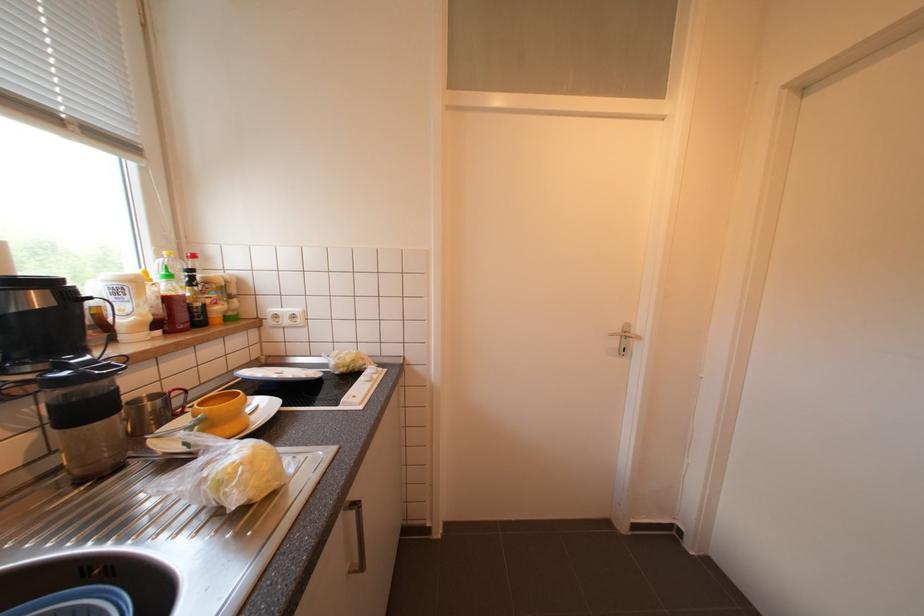
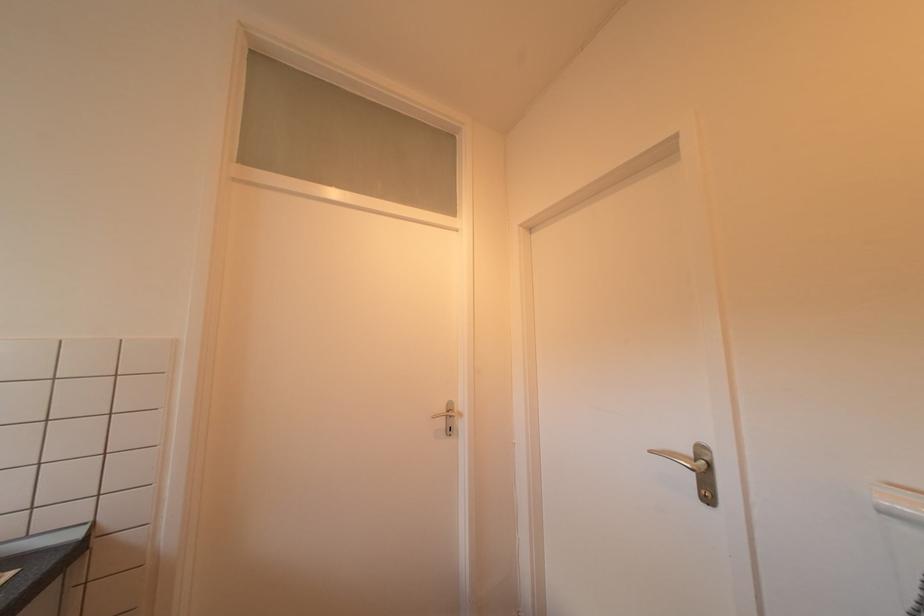
Question: Based on the continuous images, in which direction is the camera rotating? Reply with the corresponding letter.

Choices:
 (A) Left
 (B) Right
 (C) Up
 (D) Down

Answer: (B)